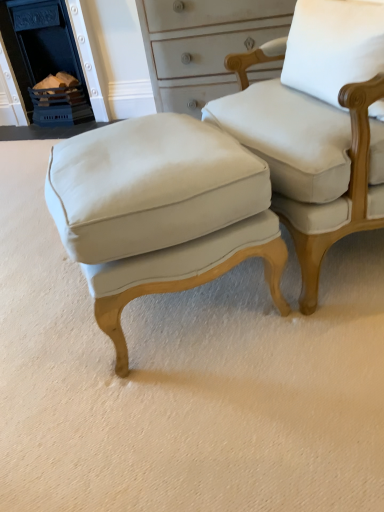
This screenshot has width=384, height=512. I want to click on white fabric pillow at upper right, so click(333, 46).

What do you see at coordinates (333, 46) in the screenshot?
I see `white fabric pillow at upper right` at bounding box center [333, 46].

This screenshot has width=384, height=512. What do you see at coordinates (317, 127) in the screenshot? I see `matte white fabric chair at center` at bounding box center [317, 127].

Locate an element on the screen. This screenshot has width=384, height=512. blue painted brick fireplace at upper left is located at coordinates pos(50,46).

Locate an element on the screen. white fabric pillow at upper right is located at coordinates tap(333, 46).

From a real-world perspective, is blue painted brick fireplace at upper left on white fabric pillow at upper right?

No, from a real-world perspective, blue painted brick fireplace at upper left is not above white fabric pillow at upper right.

Based on the photo, would you say white fabric pillow at upper right is part of blue painted brick fireplace at upper left's contents?

No, blue painted brick fireplace at upper left does not contain white fabric pillow at upper right.

Which is nearer, (76,16) or (311,60)?

Point (76,16) appears to be farther away from the viewer than point (311,60).

Identify the location of pillow below the blue painted brick fireplace at upper left (from the image's perspective). Image resolution: width=384 pixels, height=512 pixels. (333, 46).

Considering the sizes of objects matte white stool at center and blue painted brick fireplace at upper left in the image provided, who is bigger, matte white stool at center or blue painted brick fireplace at upper left?

With larger size is matte white stool at center.

From a real-world perspective, who is located lower, matte white stool at center or blue painted brick fireplace at upper left?

matte white stool at center, from a real-world perspective.

Which is in front, point (156, 213) or point (14, 67)?

Positioned in front is point (156, 213).

Is matte white stool at center inside the boundaries of blue painted brick fireplace at upper left, or outside?

matte white stool at center exists outside the volume of blue painted brick fireplace at upper left.

Does point (329, 62) appear closer or farther from the camera than point (143, 142)?

Point (329, 62) is positioned farther from the camera compared to point (143, 142).

Which of these two, white fabric pillow at upper right or matte white stool at center, stands taller?

matte white stool at center.

What's the angular difference between white fabric pillow at upper right and matte white stool at center's facing directions?

173 degrees separate the facing orientations of white fabric pillow at upper right and matte white stool at center.

Which is nearer, (354, 124) or (105, 114)?

The point (354, 124) is closer to the camera.

Identify the location of chair beneath the blue painted brick fireplace at upper left (from a real-world perspective). The width and height of the screenshot is (384, 512). (317, 127).

Is matte white fabric chair at center thinner than blue painted brick fireplace at upper left?

In fact, matte white fabric chair at center might be wider than blue painted brick fireplace at upper left.

From a real-world perspective, relative to blue painted brick fireplace at upper left, is matte white fabric chair at center vertically above or below?

In terms of real-world spatial position, matte white fabric chair at center is below blue painted brick fireplace at upper left.

In the image, is matte white stool at center positioned in front of or behind white fabric pillow at upper right?

In the image, matte white stool at center appears in front of white fabric pillow at upper right.

Is matte white stool at center bigger or smaller than white fabric pillow at upper right?

Considering their sizes, matte white stool at center takes up more space than white fabric pillow at upper right.

How different are the orientations of matte white stool at center and white fabric pillow at upper right in degrees?

They differ by 173 degrees in their facing directions.

From a real-world perspective, is matte white fabric chair at center beneath matte white stool at center?

Actually, matte white fabric chair at center is physically above matte white stool at center in the real world.

Is matte white fabric chair at center positioned far away from matte white stool at center?

No, matte white fabric chair at center is not far away from matte white stool at center.

How many degrees apart are the facing directions of matte white fabric chair at center and matte white stool at center?

The facing directions of matte white fabric chair at center and matte white stool at center are 177 degrees apart.

Consider the image. From the image's perspective, is matte white fabric chair at center over matte white stool at center?

Yes, from the image's perspective, matte white fabric chair at center is on top of matte white stool at center.

Considering the sizes of objects blue painted brick fireplace at upper left and matte white stool at center in the image provided, who is bigger, blue painted brick fireplace at upper left or matte white stool at center?

With larger size is matte white stool at center.

Considering their positions, is blue painted brick fireplace at upper left located in front of or behind matte white stool at center?

Clearly, blue painted brick fireplace at upper left is behind matte white stool at center.

Can you confirm if blue painted brick fireplace at upper left is thinner than matte white stool at center?

Indeed, blue painted brick fireplace at upper left has a lesser width compared to matte white stool at center.

From a real-world perspective, relative to matte white stool at center, is blue painted brick fireplace at upper left vertically above or below?

In terms of real-world spatial position, blue painted brick fireplace at upper left is above matte white stool at center.

This screenshot has height=512, width=384. Find the location of `pillow that is below the blue painted brick fireplace at upper left (from the image's perspective)`. pillow that is below the blue painted brick fireplace at upper left (from the image's perspective) is located at coordinates (333, 46).

Where is `fireplace located above the matte white stool at center (from a real-world perspective)`? The width and height of the screenshot is (384, 512). fireplace located above the matte white stool at center (from a real-world perspective) is located at coordinates coord(50,46).

Considering their positions, is white fabric pillow at upper right positioned closer to matte white stool at center than matte white fabric chair at center?

matte white fabric chair at center is positioned closer to the anchor matte white stool at center.

Considering their positions, is matte white fabric chair at center positioned closer to matte white stool at center than blue painted brick fireplace at upper left?

Among the two, matte white fabric chair at center is located nearer to matte white stool at center.

Estimate the real-world distances between objects in this image. Which object is closer to blue painted brick fireplace at upper left, white fabric pillow at upper right or matte white fabric chair at center?

matte white fabric chair at center lies closer to blue painted brick fireplace at upper left than the other object.

Based on their spatial positions, is white fabric pillow at upper right or matte white stool at center further from blue painted brick fireplace at upper left?

white fabric pillow at upper right is further to blue painted brick fireplace at upper left.

Estimate the real-world distances between objects in this image. Which object is further from matte white stool at center, blue painted brick fireplace at upper left or matte white fabric chair at center?

blue painted brick fireplace at upper left lies further to matte white stool at center than the other object.

Looking at the image, which one is located closer to matte white fabric chair at center, blue painted brick fireplace at upper left or matte white stool at center?

matte white stool at center lies closer to matte white fabric chair at center than the other object.

From the image, which object appears to be farther from blue painted brick fireplace at upper left, matte white stool at center or white fabric pillow at upper right?

white fabric pillow at upper right lies further to blue painted brick fireplace at upper left than the other object.

From the image, which object appears to be nearer to matte white stool at center, white fabric pillow at upper right or blue painted brick fireplace at upper left?

white fabric pillow at upper right lies closer to matte white stool at center than the other object.

Identify the location of pillow situated between matte white stool at center and matte white fabric chair at center from left to right. The height and width of the screenshot is (512, 384). (333, 46).

This screenshot has width=384, height=512. I want to click on pillow between matte white stool at center and blue painted brick fireplace at upper left along the z-axis, so click(333, 46).

Locate an element on the screen. pillow between matte white fabric chair at center and blue painted brick fireplace at upper left in the front-back direction is located at coordinates (333, 46).

Where is `stool between matte white fabric chair at center and blue painted brick fireplace at upper left from front to back`? stool between matte white fabric chair at center and blue painted brick fireplace at upper left from front to back is located at coordinates tap(160, 211).